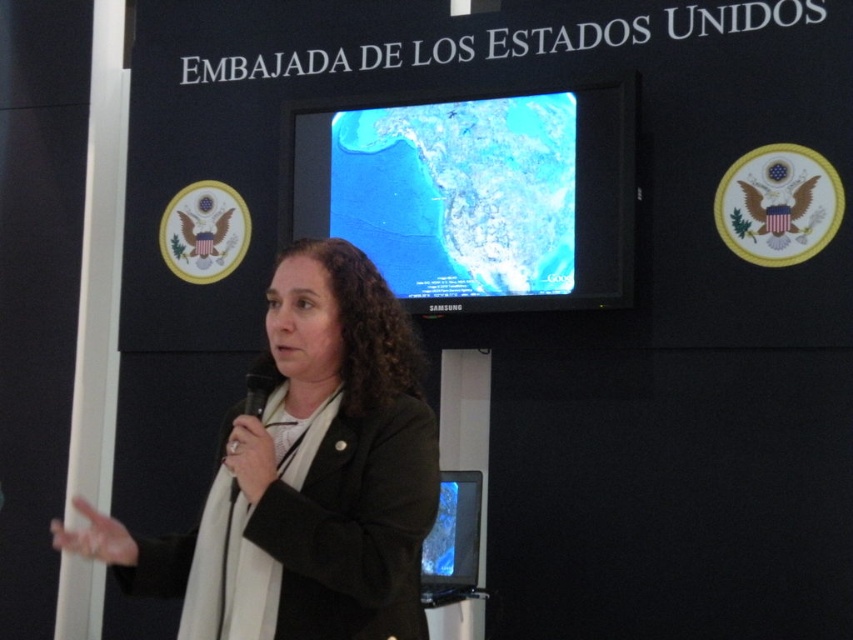
You are a photographer trying to capture a closeup of the woman giving a presentation. You notice two points in the image at coordinates point (x=508, y=275) and point (x=479, y=536). Which point should you focus on to ensure the woman is in sharp focus?

Point (x=508, y=275) is further to the viewer than point (x=479, y=536), so focusing on point (x=508, y=275) will ensure the woman is in sharp focus since it is closer to the viewer.

You are standing in a room where a presentation is taking place. You see a woman holding a microphone and gesturing, and there is an object at point (x=474, y=193). What is the object located at that coordinate?

The matte black screen at center is located at point (x=474, y=193).

You are a stagehand who needs to adjust the distance between the black matte blazer at center and the matte blue screen at center to exactly 6 feet for a camera shot. Based on the current setup, is the distance sufficient or does it need adjustment?

The black matte blazer at center is currently 5.03 feet away from the matte blue screen at center, which is less than the required 6 feet. Therefore, the distance needs to be increased to meet the requirement.